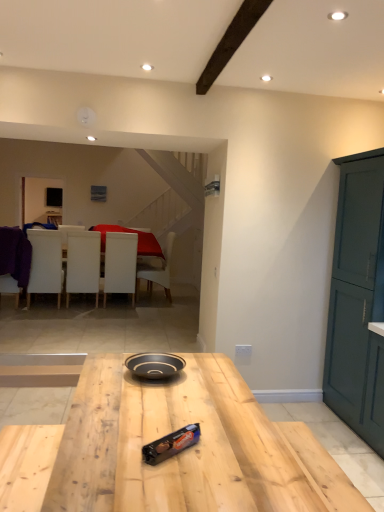
Find the location of a particular element. The image size is (384, 512). free location above natural wood table at center (from a real-world perspective) is located at coordinates (173, 403).